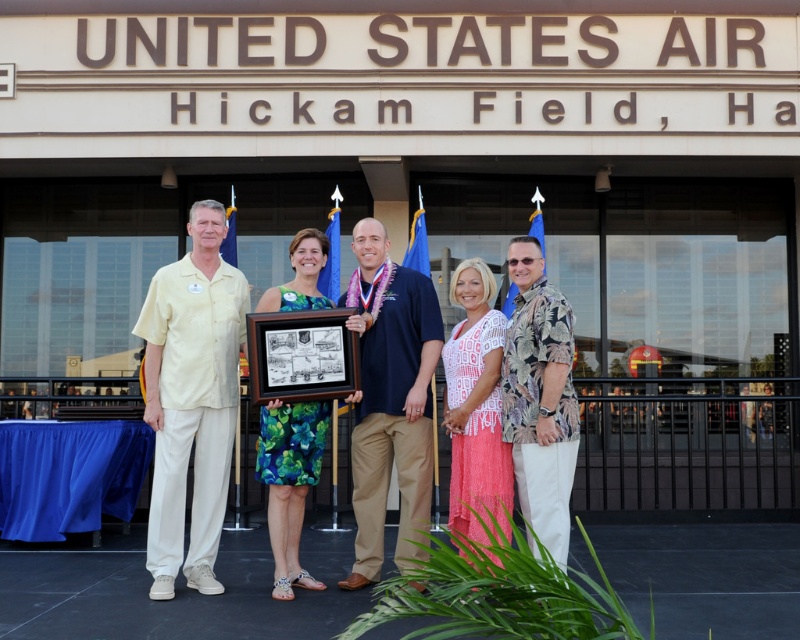
Can you confirm if dark blue shirt at center is smaller than hawaiian print shirt at center?

Actually, dark blue shirt at center might be larger than hawaiian print shirt at center.

Is dark blue shirt at center positioned before hawaiian print shirt at center?

No, dark blue shirt at center is behind hawaiian print shirt at center.

Locate an element on the screen. Image resolution: width=800 pixels, height=640 pixels. dark blue shirt at center is located at coordinates (390, 401).

Who is positioned more to the left, yellow cotton shirt at left or hawaiian print shirt at center?

yellow cotton shirt at left

You are a GUI agent. You are given a task and a screenshot of the screen. Output one action in this format:
    pyautogui.click(x=<x>, y=<y>)
    Task: Click on the yellow cotton shirt at left
    
    Given the screenshot: What is the action you would take?
    pyautogui.click(x=192, y=397)

Does point (176, 572) lie in front of point (354, 324)?

That is False.

Is yellow cotton shirt at left shorter than dark blue shirt at center?

In fact, yellow cotton shirt at left may be taller than dark blue shirt at center.

Is point (164, 378) closer to camera compared to point (358, 288)?

Yes, it is in front of point (358, 288).

Locate an element on the screen. yellow cotton shirt at left is located at coordinates (192, 397).